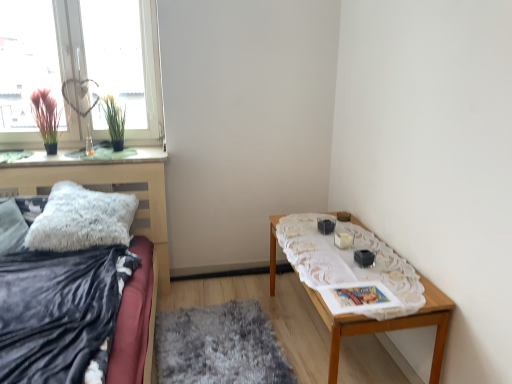
Locate an element on the screen. This screenshot has height=384, width=512. free point below fuzzy gray rug at center (from a real-world perspective) is located at coordinates (225, 344).